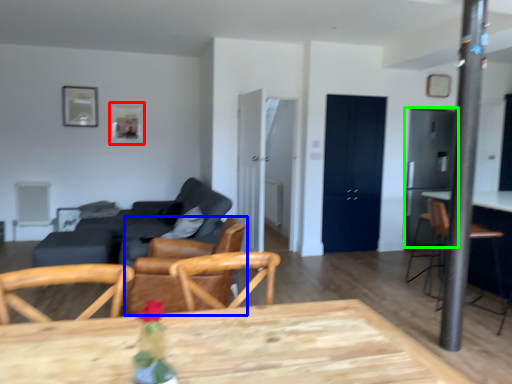
Question: Which object is positioned farthest from picture frame (highlighted by a red box)? Select from chair (highlighted by a blue box) and appliance (highlighted by a green box).

Choices:
 (A) chair
 (B) appliance

Answer: (B)